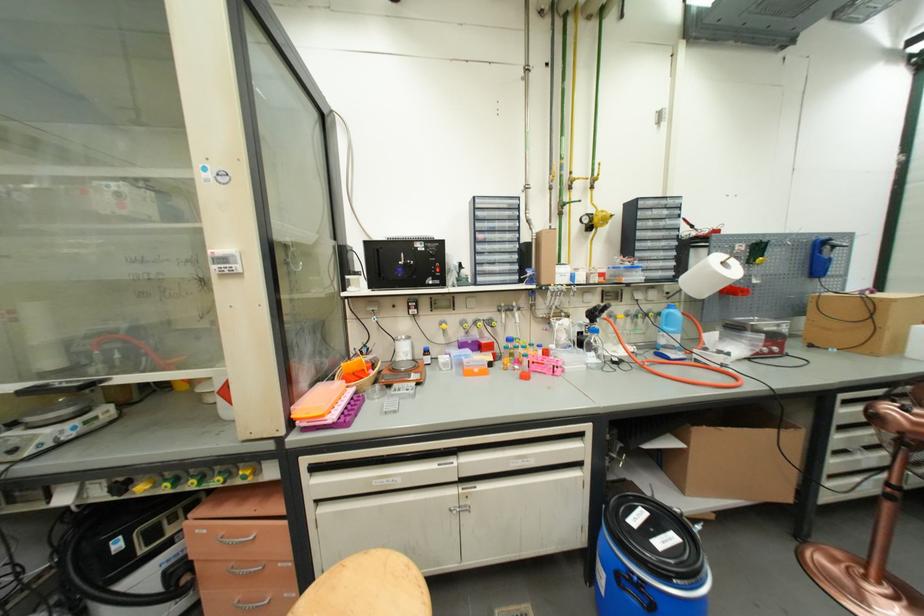
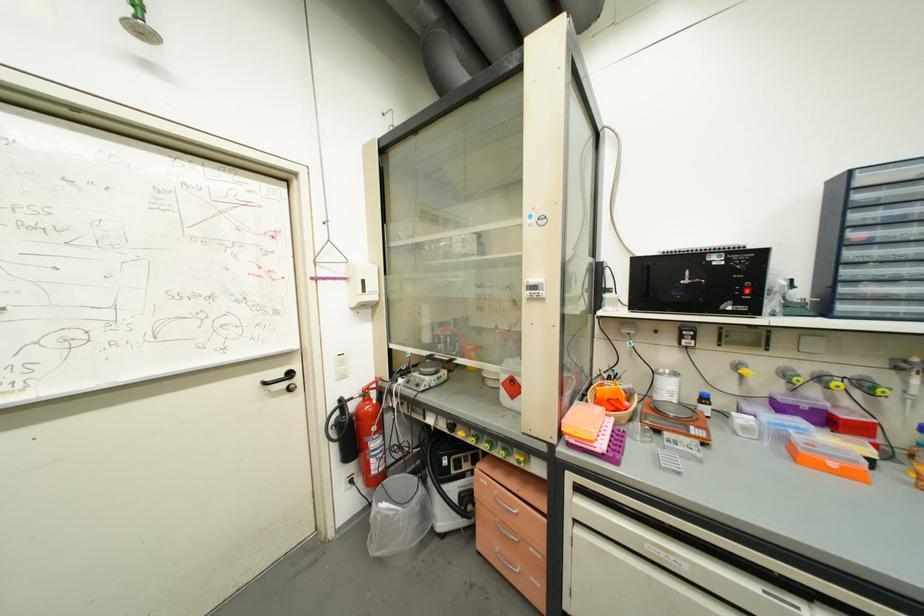
Locate, in the second image, the point that corresponds to (457,464) in the first image.

(803, 610)